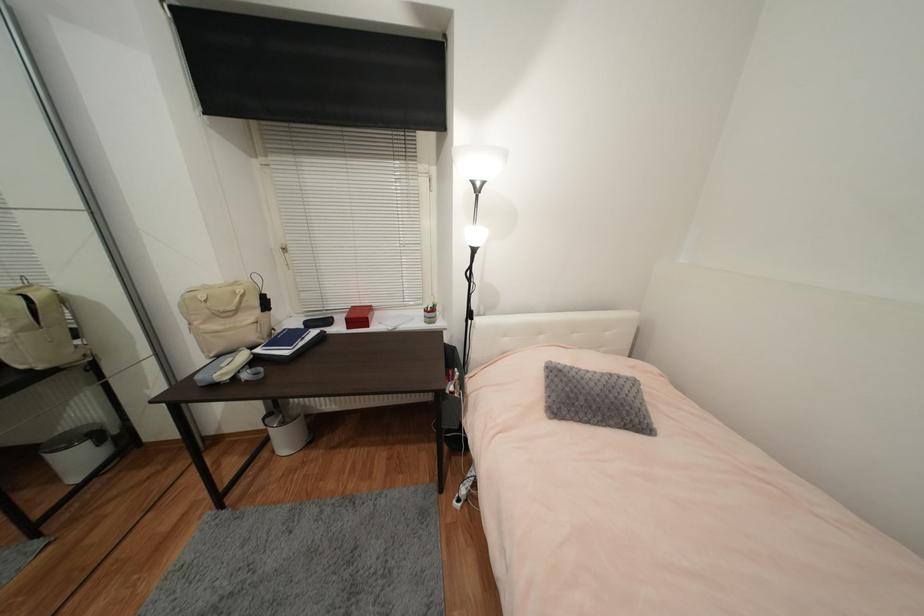
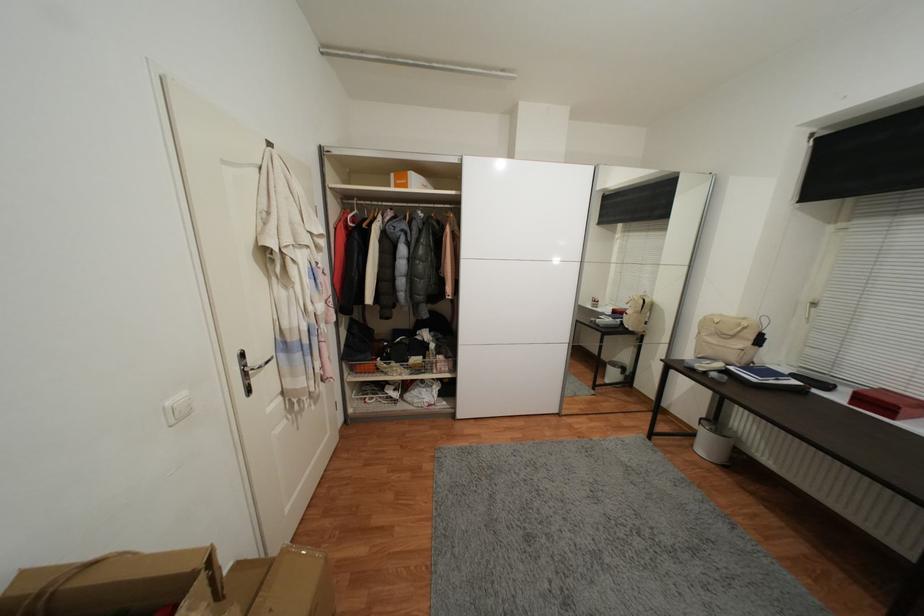
Find the pixel in the second image that matches point (372, 328) in the first image.

(897, 419)